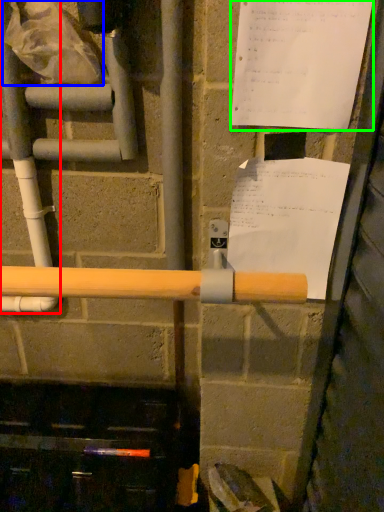
Question: Based on their relative distances, which object is nearer to water pipe (highlighted by a red box)? Choose from plastic bag (highlighted by a blue box) and paper (highlighted by a green box).

Choices:
 (A) plastic bag
 (B) paper

Answer: (A)